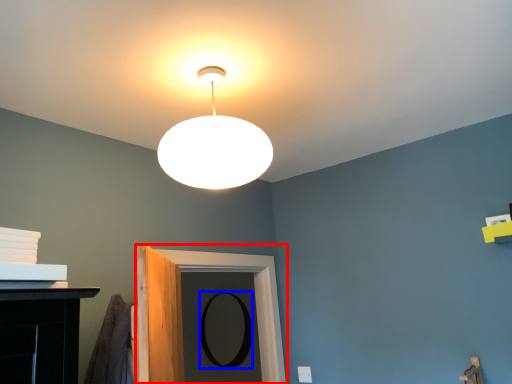
Question: Which object appears closest to the camera in this image, door (highlighted by a red box) or mirror (highlighted by a blue box)?

Choices:
 (A) door
 (B) mirror

Answer: (A)